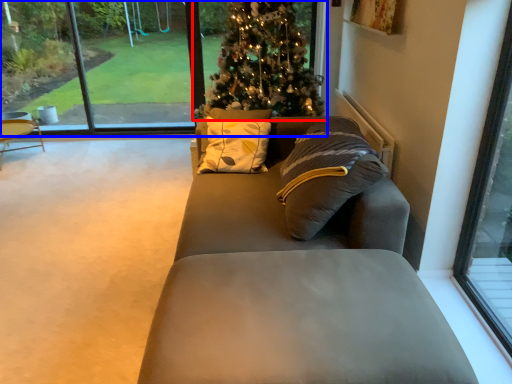
Question: Which object appears closest to the camera in this image, christmas tree (highlighted by a red box) or window (highlighted by a blue box)?

Choices:
 (A) christmas tree
 (B) window

Answer: (A)